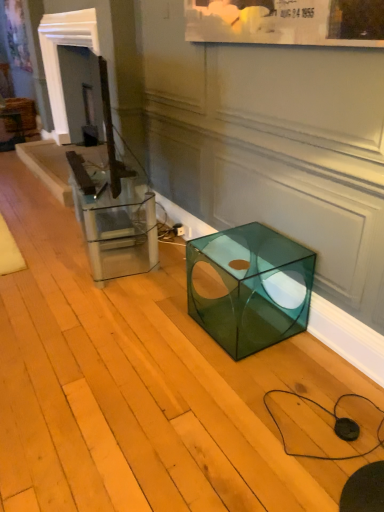
The width and height of the screenshot is (384, 512). What do you see at coordinates (114, 221) in the screenshot?
I see `clear glass cube at center` at bounding box center [114, 221].

Where is `clear glass cube at center`? clear glass cube at center is located at coordinates (114, 221).

From a real-world perspective, is white glossy fireplace at upper left physically located above or below clear glass cube at center?

Clearly, from a real-world perspective, white glossy fireplace at upper left is above clear glass cube at center.

Is white glossy fireplace at upper left surrounding clear glass cube at center?

Definitely not — clear glass cube at center is not inside white glossy fireplace at upper left.

Which is in front, point (96, 13) or point (80, 186)?

The point (80, 186) is in front.

Find the location of a particular element. Image resolution: width=384 pixels, height=512 pixels. glass box located below the white glossy fireplace at upper left (from the image's perspective) is located at coordinates (114, 221).

From a real-world perspective, is transparent green cube at lower right physically above clear glass cube at center?

Incorrect, from a real-world perspective, transparent green cube at lower right is lower than clear glass cube at center.

Can you confirm if transparent green cube at lower right is wider than clear glass cube at center?

Correct, the width of transparent green cube at lower right exceeds that of clear glass cube at center.

In the scene shown: From the image's perspective, is transparent green cube at lower right under clear glass cube at center?

Yes.

Does transparent green cube at lower right lie in front of clear glass cube at center?

Yes.

Considering the positions of objects clear glass cube at center and transparent green cube at lower right in the image provided, who is in front, clear glass cube at center or transparent green cube at lower right?

transparent green cube at lower right is closer to the camera.

From a real-world perspective, between clear glass cube at center and transparent green cube at lower right, who is vertically higher?

From a 3D spatial view, clear glass cube at center is above.

Considering the sizes of clear glass cube at center and transparent green cube at lower right in the image, is clear glass cube at center taller or shorter than transparent green cube at lower right?

clear glass cube at center is taller than transparent green cube at lower right.

Does clear glass cube at center contain transparent green cube at lower right?

No, transparent green cube at lower right is located outside of clear glass cube at center.

Looking at this image, considering the relative positions of clear glass cube at center and white glossy fireplace at upper left in the image provided, is clear glass cube at center to the right of white glossy fireplace at upper left from the viewer's perspective?

Indeed, clear glass cube at center is positioned on the right side of white glossy fireplace at upper left.

Which of these two, clear glass cube at center or white glossy fireplace at upper left, stands shorter?

Standing shorter between the two is clear glass cube at center.

From a real-world perspective, which is physically below, clear glass cube at center or white glossy fireplace at upper left?

In real-world perspective, clear glass cube at center is lower.

Is clear glass cube at center closer to camera compared to white glossy fireplace at upper left?

Yes, it is.

Who is taller, white glossy fireplace at upper left or transparent green cube at lower right?

With more height is white glossy fireplace at upper left.

Does white glossy fireplace at upper left appear on the right side of transparent green cube at lower right?

No, white glossy fireplace at upper left is not to the right of transparent green cube at lower right.

Locate an element on the screen. This screenshot has height=512, width=384. fireplace above the transparent green cube at lower right (from the image's perspective) is located at coordinates (58, 59).

From a real-world perspective, is white glossy fireplace at upper left on transparent green cube at lower right?

Correct, in the physical world, white glossy fireplace at upper left is higher than transparent green cube at lower right.

Considering the relative positions of transparent green cube at lower right and white glossy fireplace at upper left in the image provided, is transparent green cube at lower right to the right of white glossy fireplace at upper left from the viewer's perspective?

Correct, you'll find transparent green cube at lower right to the right of white glossy fireplace at upper left.

Which is in front, point (223, 233) or point (93, 42)?

Positioned in front is point (223, 233).

Is transparent green cube at lower right outside of white glossy fireplace at upper left?

That's correct, transparent green cube at lower right is outside of white glossy fireplace at upper left.

Who is more distant, transparent green cube at lower right or white glossy fireplace at upper left?

white glossy fireplace at upper left.

Image resolution: width=384 pixels, height=512 pixels. I want to click on glass box that appears on the right of white glossy fireplace at upper left, so click(x=114, y=221).

The height and width of the screenshot is (512, 384). I want to click on table in front of the clear glass cube at center, so click(x=249, y=287).

Based on their spatial positions, is white glossy fireplace at upper left or clear glass cube at center closer to transparent green cube at lower right?

Among the two, clear glass cube at center is located nearer to transparent green cube at lower right.

In the scene shown: Considering their positions, is transparent green cube at lower right positioned closer to white glossy fireplace at upper left than clear glass cube at center?

clear glass cube at center.

Looking at the image, which one is located further to clear glass cube at center, transparent green cube at lower right or white glossy fireplace at upper left?

white glossy fireplace at upper left is positioned further to the anchor clear glass cube at center.

From the image, which object appears to be nearer to clear glass cube at center, white glossy fireplace at upper left or transparent green cube at lower right?

transparent green cube at lower right.

Based on the photo, when comparing their distances from white glossy fireplace at upper left, does clear glass cube at center or transparent green cube at lower right seem further?

transparent green cube at lower right is positioned further to the anchor white glossy fireplace at upper left.

Consider the image. Which object lies nearer to the anchor point transparent green cube at lower right, clear glass cube at center or white glossy fireplace at upper left?

The object closer to transparent green cube at lower right is clear glass cube at center.

What are the coordinates of `glass box between white glossy fireplace at upper left and transparent green cube at lower right from top to bottom` in the screenshot? It's located at (114, 221).